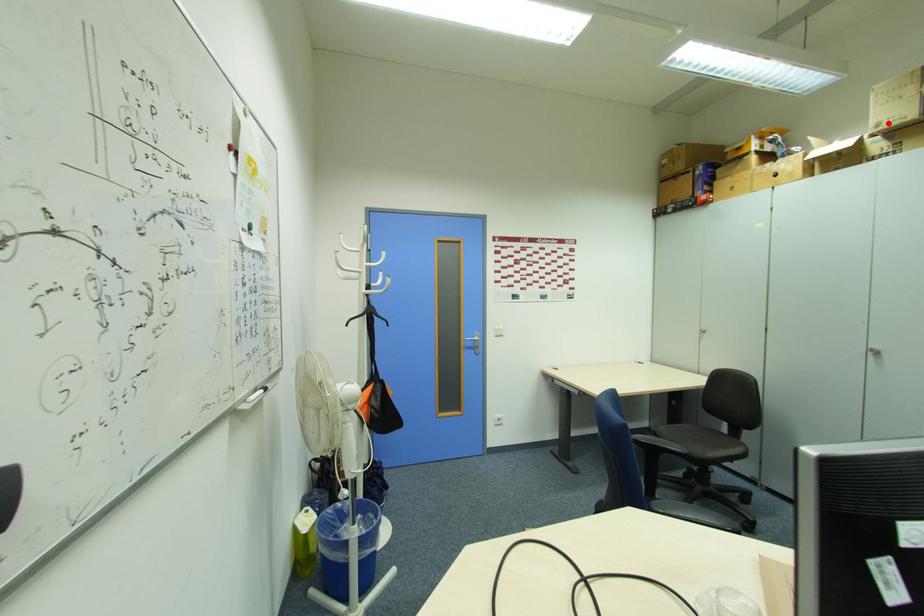
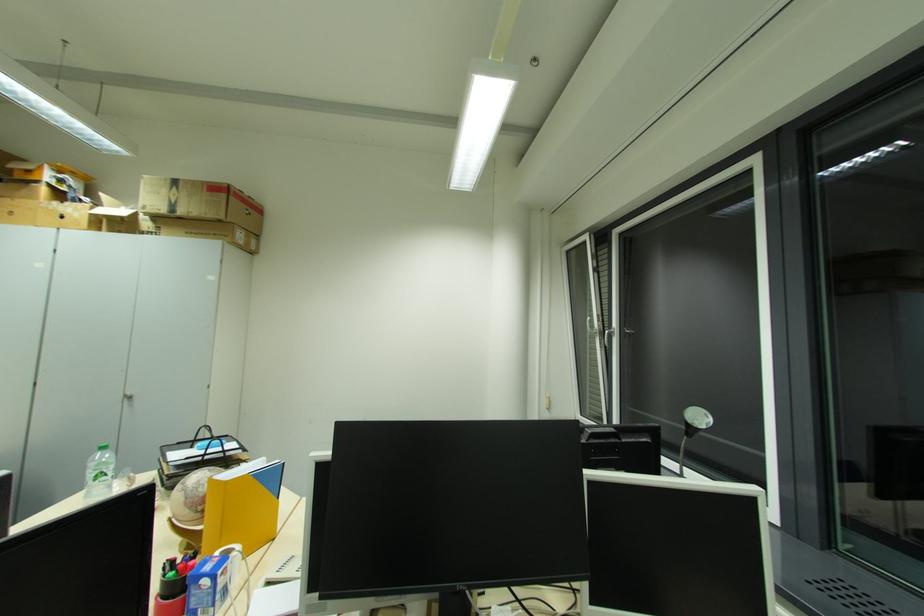
In the second image, find the point that corresponds to the highlighted location in the first image.

(152, 209)